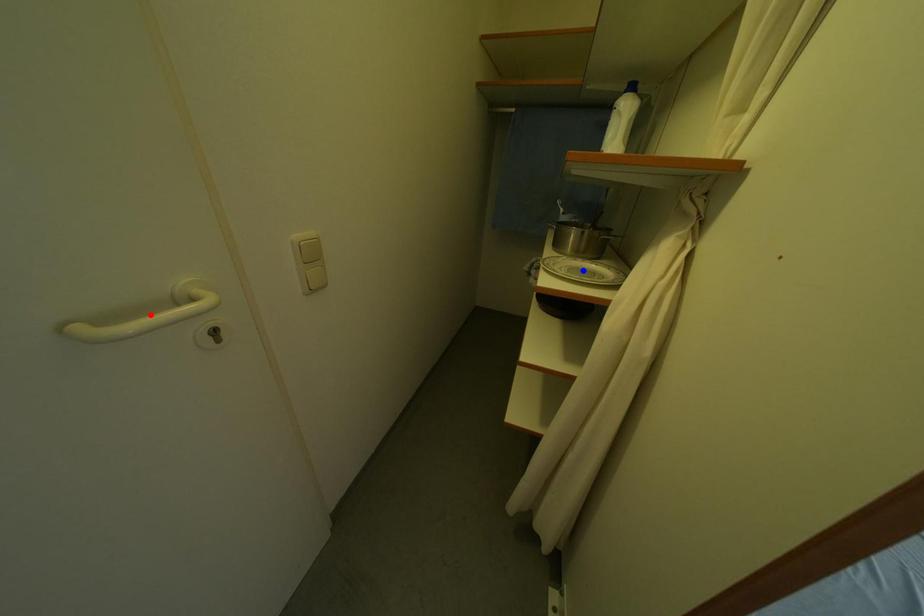
Question: In the image, two points are highlighted. Which point is nearer to the camera? Reply with the corresponding letter.

Choices:
 (A) blue point
 (B) red point

Answer: (B)